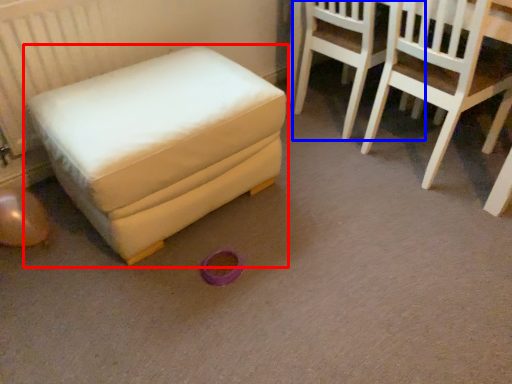
Question: Which of the following is the farthest to the observer, furniture (highlighted by a red box) or chair (highlighted by a blue box)?

Choices:
 (A) furniture
 (B) chair

Answer: (B)